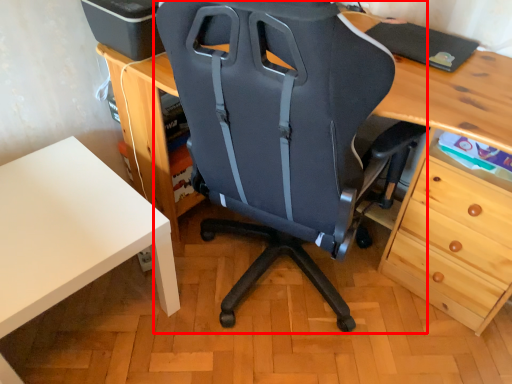
Question: From the image's perspective, where is chair (annotated by the red box) located relative to table?

Choices:
 (A) below
 (B) above

Answer: (B)